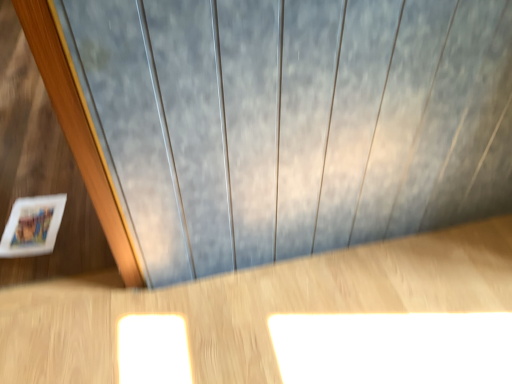
This screenshot has width=512, height=384. What do you see at coordinates (340, 293) in the screenshot?
I see `light wood table at center` at bounding box center [340, 293].

Where is `light wood table at center`? light wood table at center is located at coordinates (340, 293).

I want to click on light wood table at center, so click(340, 293).